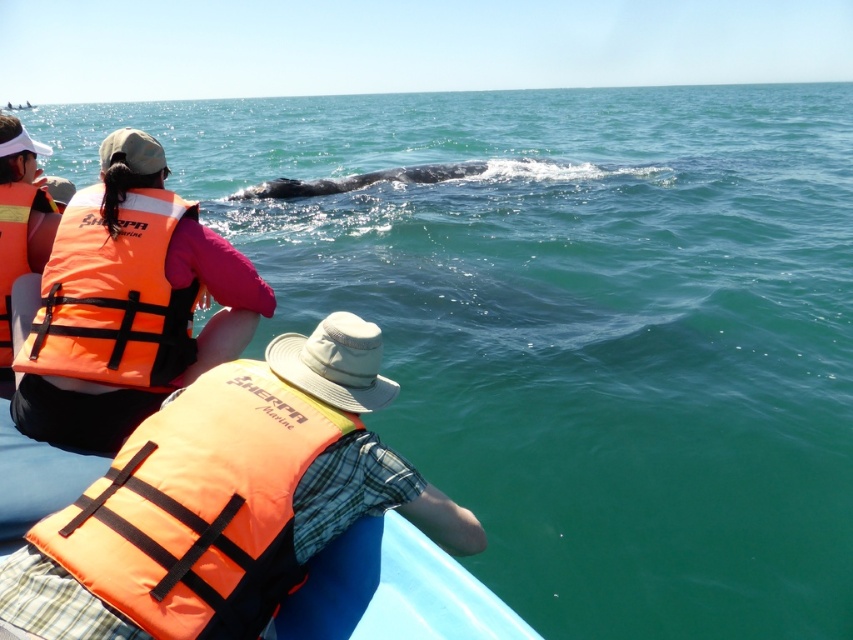
From the picture: Can you confirm if orange fabric life jacket at left is positioned below orange life jacket at left?

Indeed, orange fabric life jacket at left is positioned under orange life jacket at left.

What do you see at coordinates (112, 296) in the screenshot? I see `orange fabric life jacket at left` at bounding box center [112, 296].

I want to click on orange fabric life jacket at left, so click(112, 296).

Between orange life vest at left and orange life jacket at left, which one is positioned lower?

orange life vest at left

Is orange life vest at left in front of orange life jacket at left?

Yes, orange life vest at left is closer to the viewer.

What are the coordinates of `orange life vest at left` in the screenshot? It's located at (126, 305).

What do you see at coordinates (369, 497) in the screenshot?
I see `orange life vest at center` at bounding box center [369, 497].

Describe the element at coordinates (369, 497) in the screenshot. The width and height of the screenshot is (853, 640). I see `orange life vest at center` at that location.

Find the location of a particular element. This screenshot has height=640, width=853. orange life vest at center is located at coordinates (369, 497).